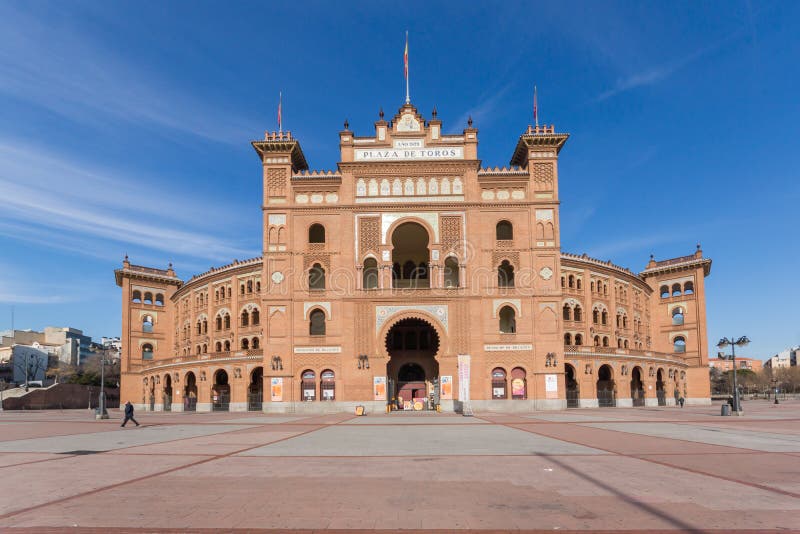
At what (x,y) coordinates should I click in order to perform the action: click on light. Please return your answer as a coordinate pair (x, y). The image size is (800, 534). Looking at the image, I should click on (742, 340), (720, 342).